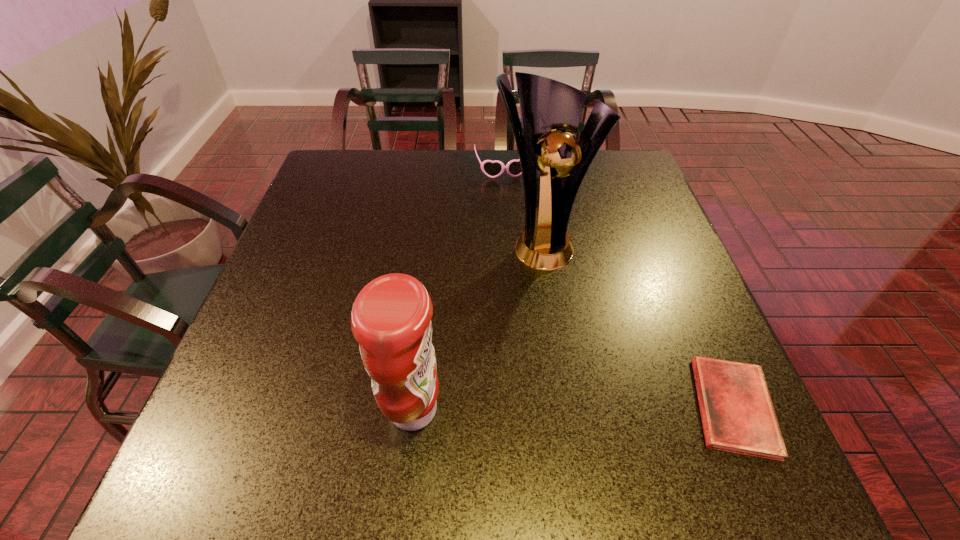
Identify the location of vacant area between the award and the sunglasses. (521, 205).

Where is `free spot between the second farthest object and the condiment`? free spot between the second farthest object and the condiment is located at coordinates (477, 326).

Locate an element on the screen. unoccupied position between the shortest object and the award is located at coordinates (637, 325).

Identify the location of vacant area between the rightmost object and the second farthest object. (637, 325).

This screenshot has width=960, height=540. Find the location of `free space between the third nearest object and the rightmost object`. free space between the third nearest object and the rightmost object is located at coordinates pos(637,325).

Where is `free space between the third nearest object and the sunglasses`? free space between the third nearest object and the sunglasses is located at coordinates (521, 205).

You are a GUI agent. You are given a task and a screenshot of the screen. Output one action in this format:
    pyautogui.click(x=<x>, y=<y>)
    Task: Click on the vacant point located between the diary and the condiment
    The image size is (960, 540).
    Given the screenshot: What is the action you would take?
    pyautogui.click(x=573, y=408)

Where is `free area in between the third nearest object and the diary`? This screenshot has width=960, height=540. free area in between the third nearest object and the diary is located at coordinates (637, 325).

Locate which object is the second closest to the rightmost object. Please provide its 2D coordinates. Your answer should be formatted as a tuple, i.e. [(x, y)], where the tuple contains the x and y coordinates of a point satisfying the conditions above.

[(391, 317)]

Point out which object is positioned as the third nearest to the diary. Please provide its 2D coordinates. Your answer should be formatted as a tuple, i.e. [(x, y)], where the tuple contains the x and y coordinates of a point satisfying the conditions above.

[(492, 169)]